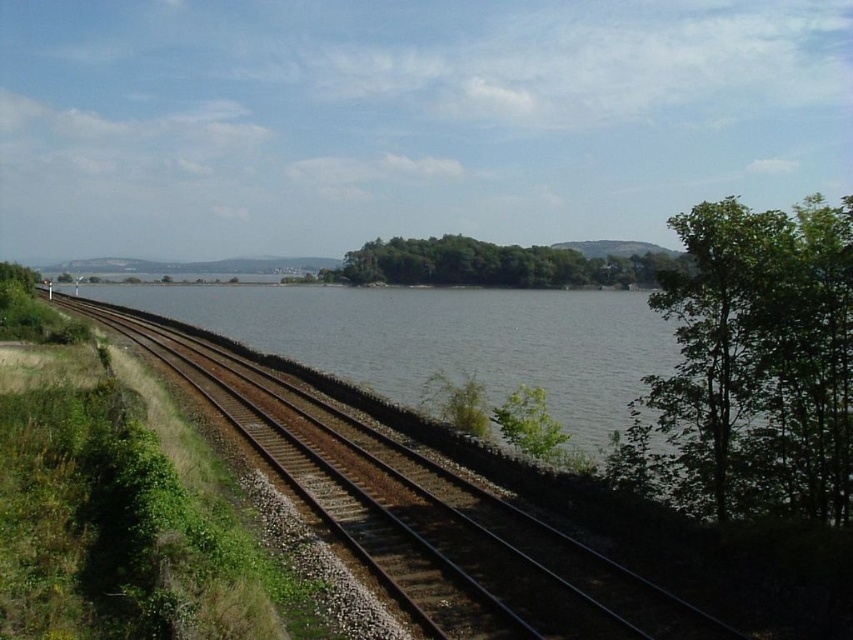
Between brown gravel track at center and green leafy island at center, which one is positioned higher?

green leafy island at center is higher up.

Does brown gravel track at center appear over green leafy island at center?

No, brown gravel track at center is not above green leafy island at center.

Which is behind, point (457, 500) or point (527, 256)?

The point (527, 256) is more distant.

In order to click on brown gravel track at center in this screenshot , I will do (x=419, y=513).

Which is above, green leafy tree at right or brown gravel track at center?

brown gravel track at center

Is point (712, 321) positioned after point (439, 637)?

Yes, point (712, 321) is farther from viewer.

Locate an element on the screen. The height and width of the screenshot is (640, 853). green leafy tree at right is located at coordinates (752, 368).

Who is shorter, green leafy tree at right or green leafy island at center?

green leafy tree at right

Can you confirm if green leafy tree at right is positioned to the left of green leafy island at center?

Indeed, green leafy tree at right is positioned on the left side of green leafy island at center.

Locate an element on the screen. This screenshot has width=853, height=640. green leafy tree at right is located at coordinates (752, 368).